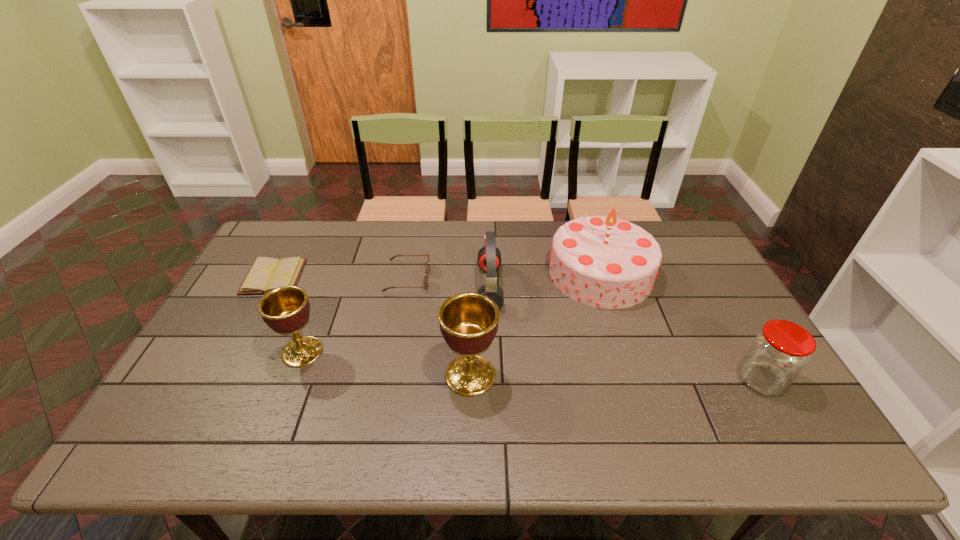
Where is `vacant space in between the jar and the sunglasses`? This screenshot has height=540, width=960. vacant space in between the jar and the sunglasses is located at coordinates (585, 329).

In order to click on vacant space that is in between the leftmost object and the fifth object from right to left in this screenshot , I will do `click(341, 278)`.

Identify which object is the nearest to the third object from left to right. Please provide its 2D coordinates. Your answer should be formatted as a tuple, i.e. [(x, y)], where the tuple contains the x and y coordinates of a point satisfying the conditions above.

[(489, 256)]

Locate an element on the screen. The height and width of the screenshot is (540, 960). object identified as the closest to the second shortest object is located at coordinates (489, 256).

Where is `blank area in the image that satisfies the following two spatial constraints: 1. on the front side of the left chalice; 2. on the right side of the right chalice`? The height and width of the screenshot is (540, 960). blank area in the image that satisfies the following two spatial constraints: 1. on the front side of the left chalice; 2. on the right side of the right chalice is located at coordinates (294, 375).

What are the coordinates of `blank area in the image that satisfies the following two spatial constraints: 1. on the lenses of the sixth tallest object; 2. on the left side of the right chalice` in the screenshot? It's located at (391, 375).

Where is `free space that satisfies the following two spatial constraints: 1. on the front side of the diary; 2. on the right side of the jar`? free space that satisfies the following two spatial constraints: 1. on the front side of the diary; 2. on the right side of the jar is located at coordinates (218, 380).

In order to click on free location that satisfies the following two spatial constraints: 1. on the lenses of the sunglasses; 2. on the left side of the right chalice in this screenshot , I will do `click(391, 375)`.